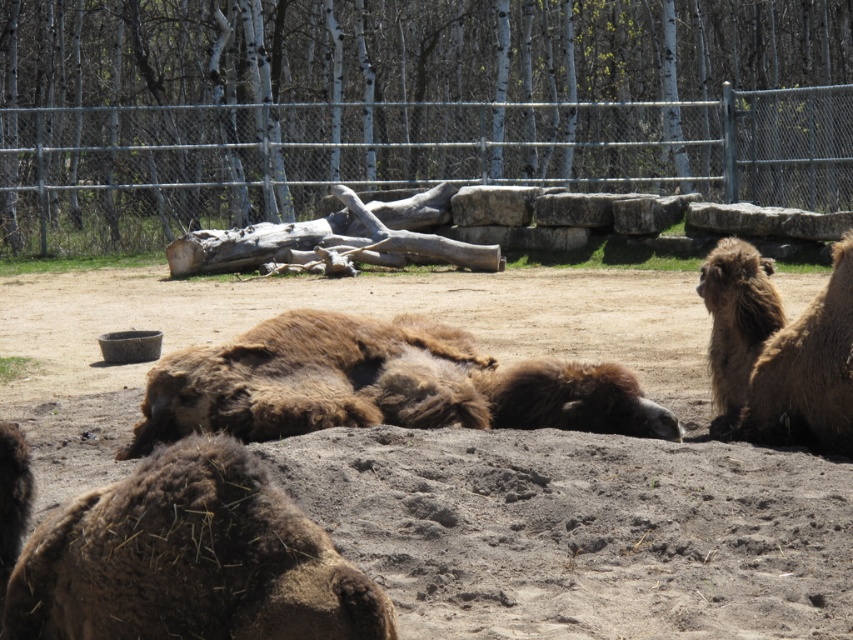
Question: Is brown fuzzy camel at center wider than brown fuzzy camel at right?

Choices:
 (A) no
 (B) yes

Answer: (B)

Question: Which of the following is the farthest from the observer?

Choices:
 (A) (549, 422)
 (B) (776, 548)

Answer: (A)

Question: Is metallic chain-link fence at upper center smaller than brown fuzzy camel at right?

Choices:
 (A) yes
 (B) no

Answer: (B)

Question: Can you confirm if brown sandy dirt at center is wider than brown fuzzy camel at right?

Choices:
 (A) yes
 (B) no

Answer: (A)

Question: Based on their relative distances, which object is nearer to the brown fuzzy camel at center?

Choices:
 (A) metallic chain-link fence at upper center
 (B) brown fuzzy camel at right

Answer: (B)

Question: Which is farther from the brown sandy dirt at center?

Choices:
 (A) metallic chain-link fence at upper center
 (B) brown fuzzy camel at center

Answer: (A)